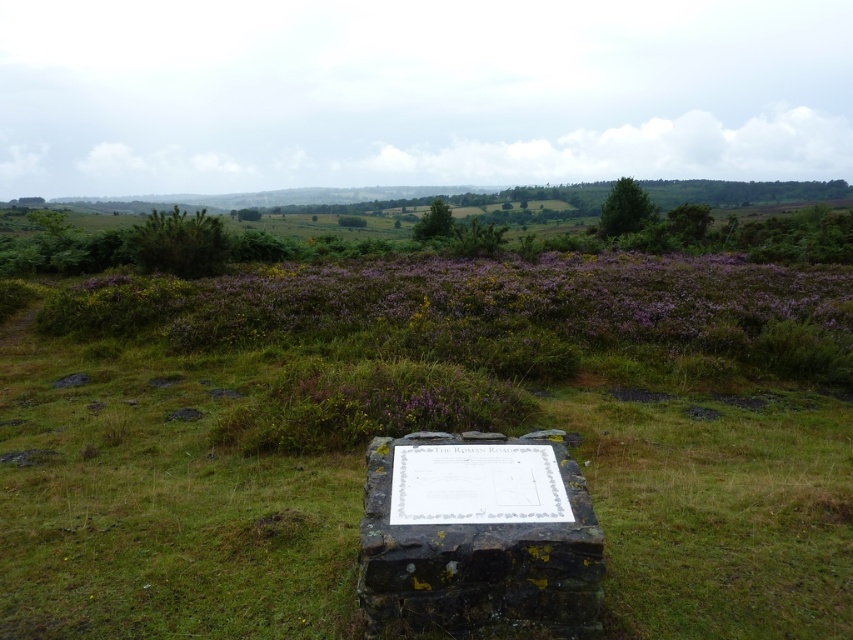
You are a hiker trying to locate the dark gray stone marker at center. You notice the purple matte heather at upper center in the distance. Which object is bigger in size?

The purple matte heather at upper center is larger in size compared to the dark gray stone marker at center.

You are standing at the stone structure with the plaque. To reach the purple matte heather at upper center, in which direction should you walk? The coordinates provided are relative to the image frame where the origin is the bottom left corner. The stone structure is at point 0.5, 0.5. Please consider the spatial relationship based on the coordinates.

The purple matte heather at upper center is located at point (465, 300). Since the stone structure is at (426, 320), the heather is slightly to the left and above the stone structure. Therefore, you should walk slightly to the left and forward to reach it.

You are standing at the edge of the grassy area and see the purple matte heather at upper center and the dark gray stone marker at center. Which object is closer to you?

The dark gray stone marker at center is closer to you because the purple matte heather at upper center is positioned over it, indicating it is further away.